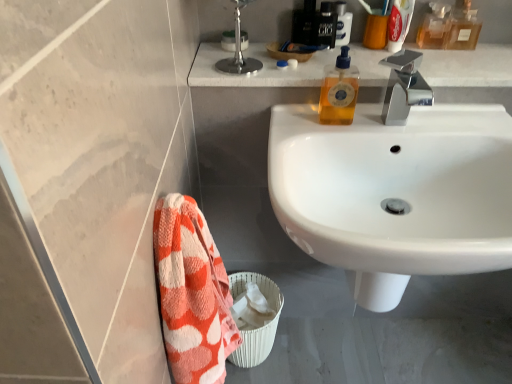
Locate an element on the screen. The image size is (512, 384). free space to the left of white plastic toothpaste tube at upper right, marked as the 2th mouthwash in a left-to-right arrangement is located at coordinates (350, 54).